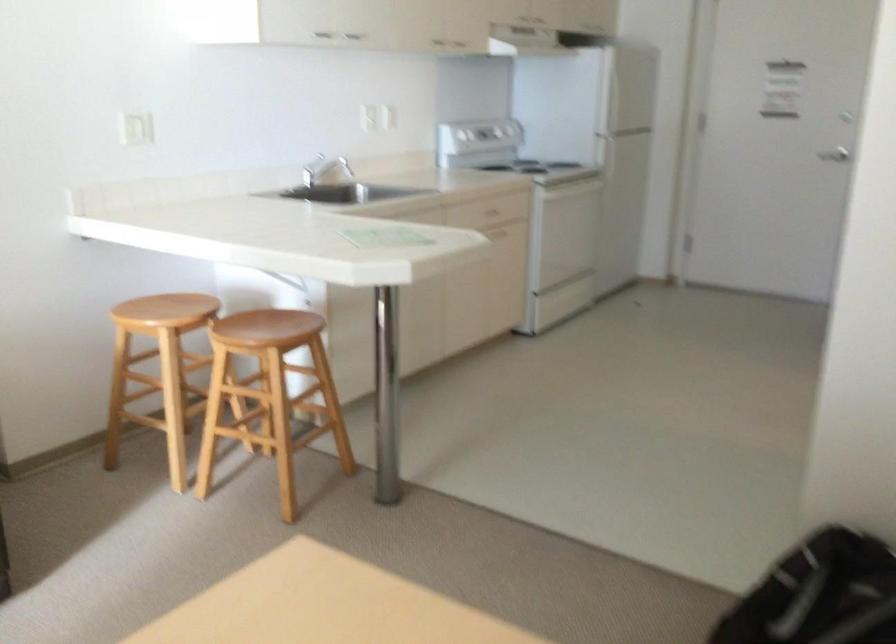
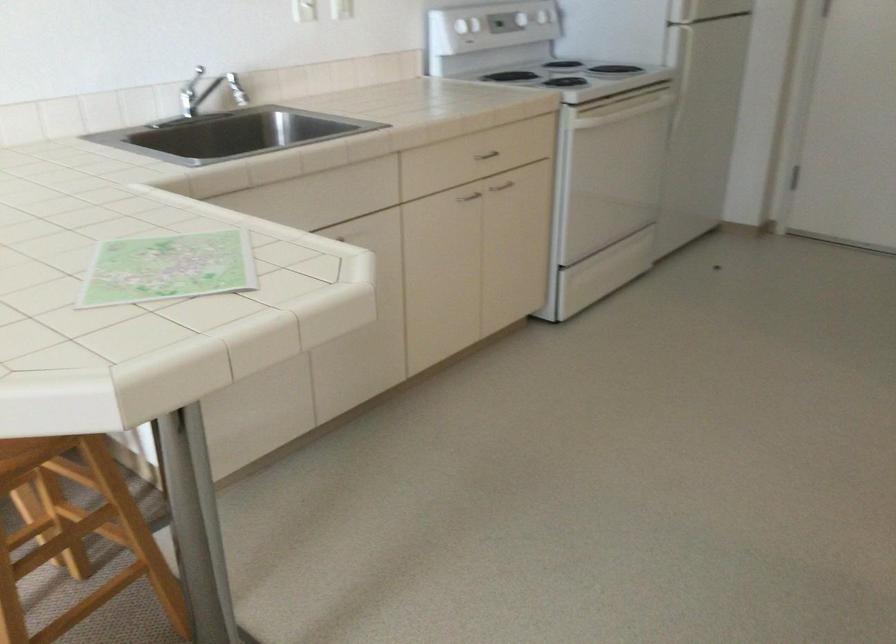
Question: The images are taken continuously from a first-person perspective. In which direction are you moving?

Choices:
 (A) Left
 (B) Right
 (C) Forward
 (D) Backward

Answer: (C)